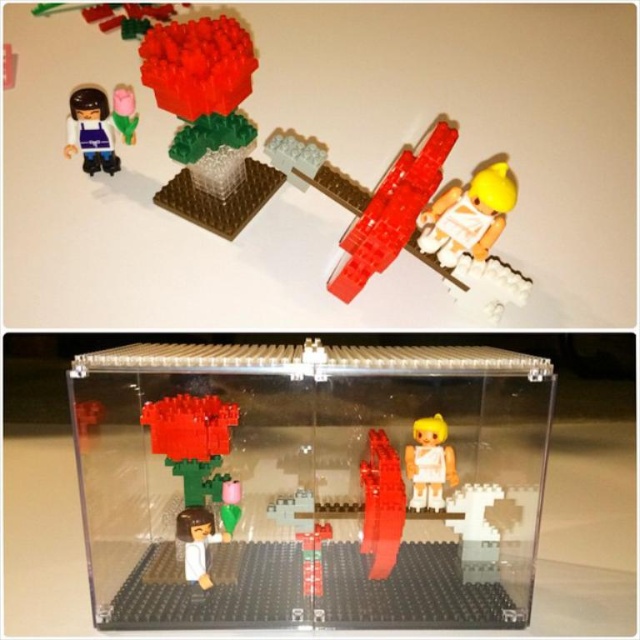
Question: Can you confirm if transparent acrylic box at center is positioned above translucent red plastic sword at upper right?

Choices:
 (A) yes
 (B) no

Answer: (B)

Question: Is the position of translucent plastic flower at upper center more distant than that of matte purple plastic figure at upper left?

Choices:
 (A) no
 (B) yes

Answer: (A)

Question: Which of the following is the closest to the observer?

Choices:
 (A) translucent plastic rose at center
 (B) white glossy minifigure at right
 (C) translucent plastic flower at upper center

Answer: (A)

Question: Can you confirm if matte purple plastic figure at upper left is wider than translucent plastic brick at center?

Choices:
 (A) yes
 (B) no

Answer: (A)

Question: Which object is the farthest from the white glossy minifigure at center?

Choices:
 (A) smooth red brick at center
 (B) white glossy minifigure at lower left
 (C) matte pink flower at upper left
 (D) translucent red plastic sword at upper right

Answer: (C)

Question: Which object is the farthest from the white glossy minifigure at lower left?

Choices:
 (A) translucent plastic rose at center
 (B) translucent plastic brick at center
 (C) white glossy minifigure at center
 (D) translucent plastic flower at upper center

Answer: (C)